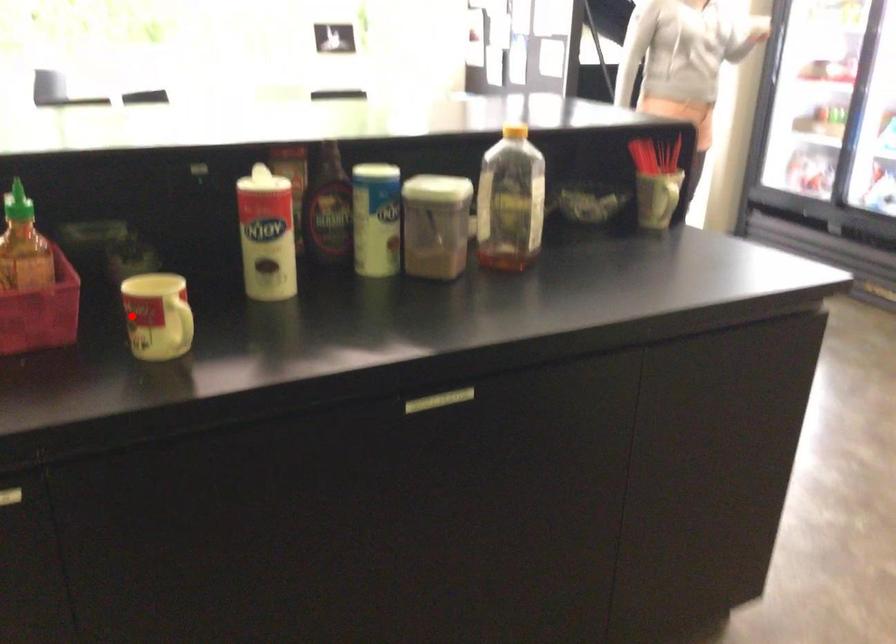
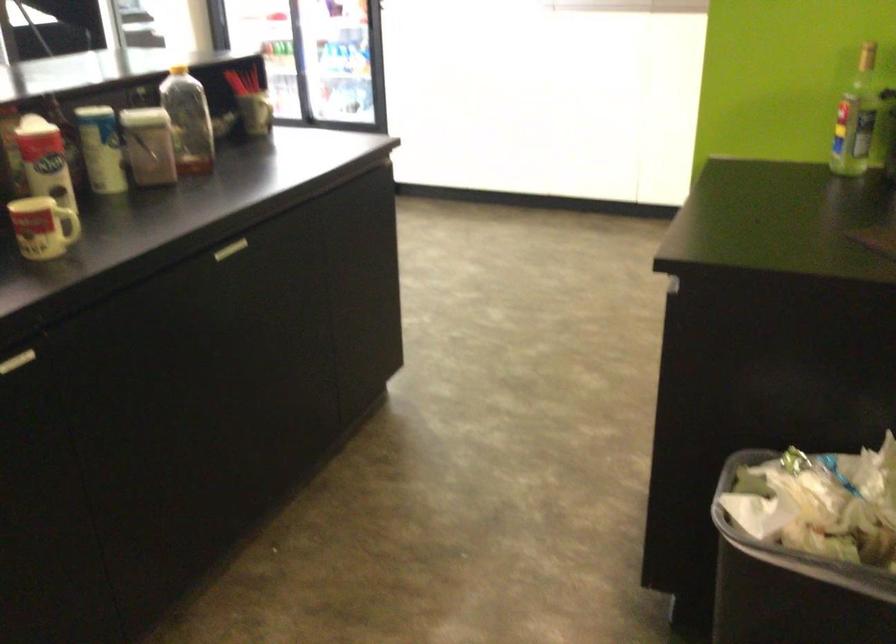
Where in the second image is the point corresponding to the highlighted location from the first image?

(42, 228)